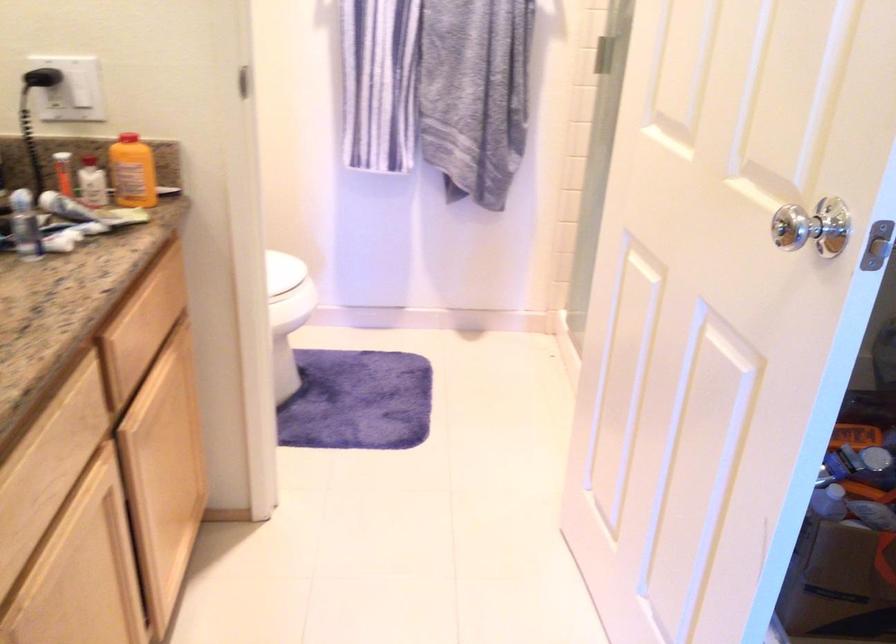
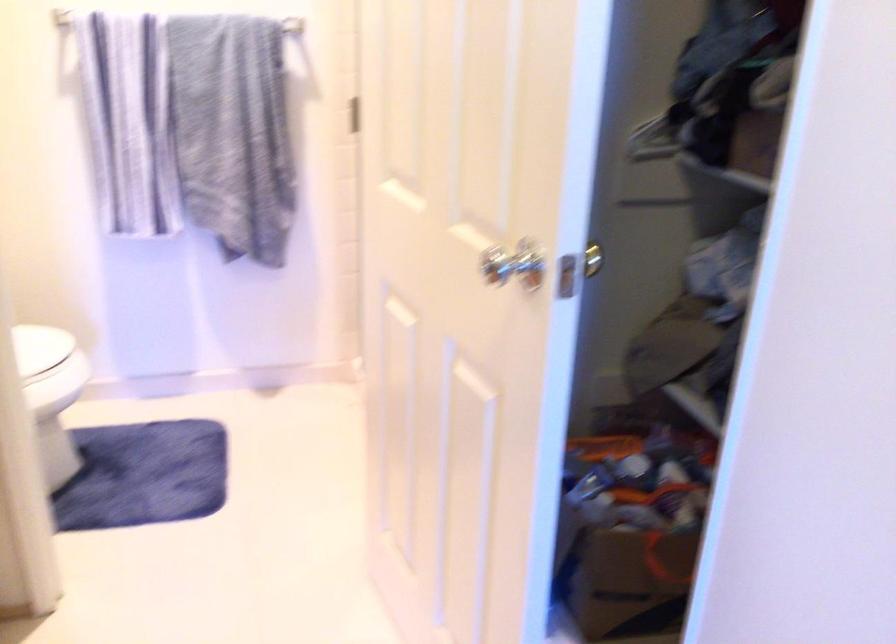
Where in the second image is the point corresponding to pixel 278 290 from the first image?

(45, 368)